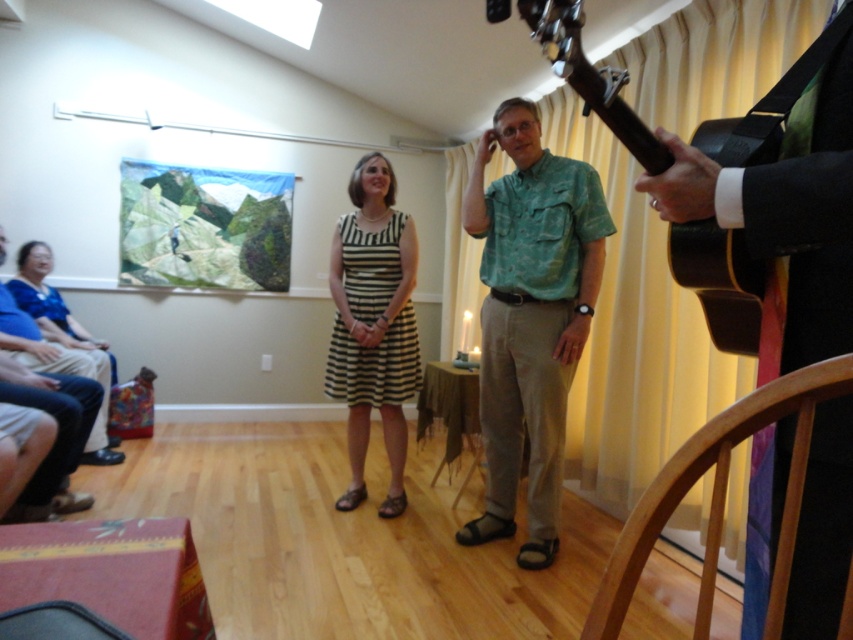
Question: In this image, where is shiny black guitar at center located relative to striped fabric dress at center?

Choices:
 (A) right
 (B) left

Answer: (A)

Question: Which object appears closest to the camera in this image?

Choices:
 (A) matte blue dress at left
 (B) shiny black guitar at center
 (C) green textured shirt at center
 (D) dark brown wood guitar at right

Answer: (B)

Question: Which object appears farthest from the camera in this image?

Choices:
 (A) striped fabric dress at center
 (B) dark brown wood guitar at right

Answer: (A)

Question: Is shiny black guitar at center to the right of matte blue dress at left from the viewer's perspective?

Choices:
 (A) yes
 (B) no

Answer: (A)

Question: Estimate the real-world distances between objects in this image. Which object is farther from the shiny black guitar at center?

Choices:
 (A) green textured shirt at center
 (B) matte blue dress at left
 (C) dark brown wood guitar at right

Answer: (B)

Question: Is green textured shirt at center bigger than striped fabric dress at center?

Choices:
 (A) yes
 (B) no

Answer: (A)